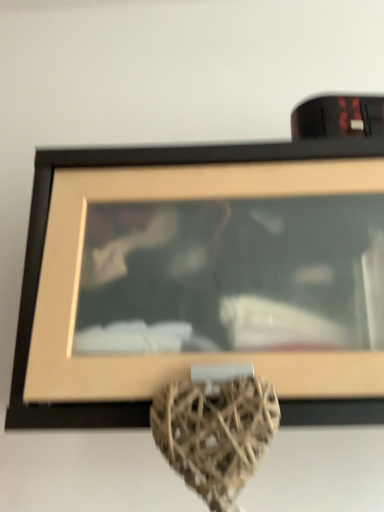
Question: Does wooden frame at upper center have a larger size compared to brown wicker heart at center?

Choices:
 (A) yes
 (B) no

Answer: (A)

Question: Are wooden frame at upper center and brown wicker heart at center far apart?

Choices:
 (A) yes
 (B) no

Answer: (B)

Question: Is brown wicker heart at center inside wooden frame at upper center?

Choices:
 (A) no
 (B) yes

Answer: (A)

Question: Is wooden frame at upper center behind brown wicker heart at center?

Choices:
 (A) no
 (B) yes

Answer: (B)

Question: Can you confirm if wooden frame at upper center is taller than brown wicker heart at center?

Choices:
 (A) no
 (B) yes

Answer: (A)

Question: Is wooden frame at upper center facing away from brown wicker heart at center?

Choices:
 (A) no
 (B) yes

Answer: (A)

Question: From the image's perspective, is brown wicker heart at center located above wooden frame at upper center?

Choices:
 (A) no
 (B) yes

Answer: (A)

Question: Is brown wicker heart at center next to wooden frame at upper center?

Choices:
 (A) no
 (B) yes

Answer: (A)

Question: Is brown wicker heart at center smaller than wooden frame at upper center?

Choices:
 (A) no
 (B) yes

Answer: (B)

Question: Is brown wicker heart at center taller than wooden frame at upper center?

Choices:
 (A) no
 (B) yes

Answer: (B)

Question: Considering the relative sizes of brown wicker heart at center and wooden frame at upper center in the image provided, is brown wicker heart at center bigger than wooden frame at upper center?

Choices:
 (A) yes
 (B) no

Answer: (B)

Question: Is brown wicker heart at center oriented towards wooden frame at upper center?

Choices:
 (A) no
 (B) yes

Answer: (A)

Question: From their relative heights in the image, would you say wooden frame at upper center is taller or shorter than brown wicker heart at center?

Choices:
 (A) tall
 (B) short

Answer: (B)